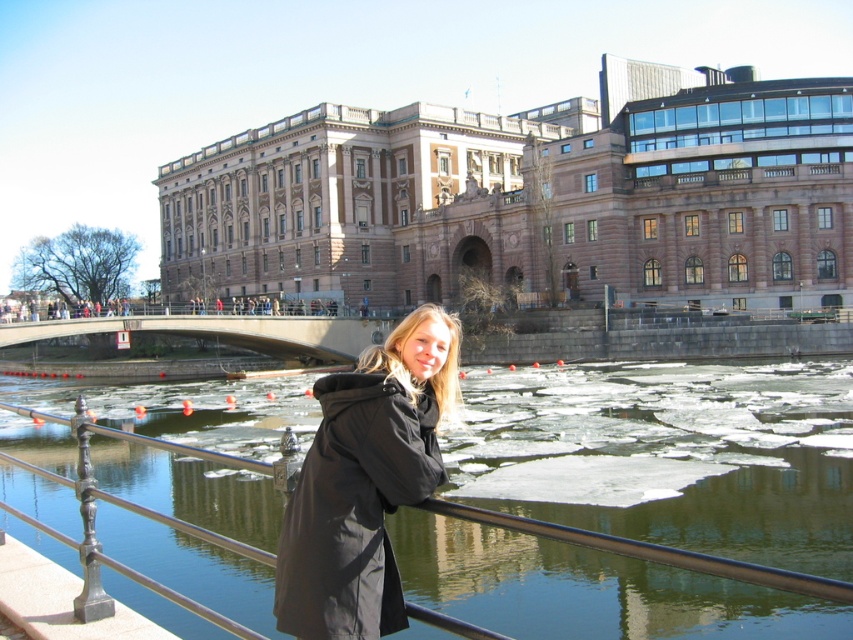
Question: Which point is closer to the camera?

Choices:
 (A) clear water at center
 (B) brown stone building at center
 (C) concrete gray bridge at center

Answer: (A)

Question: Which object appears closest to the camera in this image?

Choices:
 (A) brown stone building at center
 (B) concrete gray bridge at center
 (C) clear water at center

Answer: (C)

Question: Can you confirm if black matte coat at center is positioned to the right of concrete gray bridge at center?

Choices:
 (A) yes
 (B) no

Answer: (A)

Question: Where is black matte coat at center located in relation to concrete gray bridge at center in the image?

Choices:
 (A) below
 (B) above

Answer: (A)

Question: Is black matte coat at center further to the viewer compared to concrete gray bridge at center?

Choices:
 (A) yes
 (B) no

Answer: (B)

Question: Which object appears closest to the camera in this image?

Choices:
 (A) black matte coat at center
 (B) clear water at center
 (C) brown stone building at center

Answer: (A)